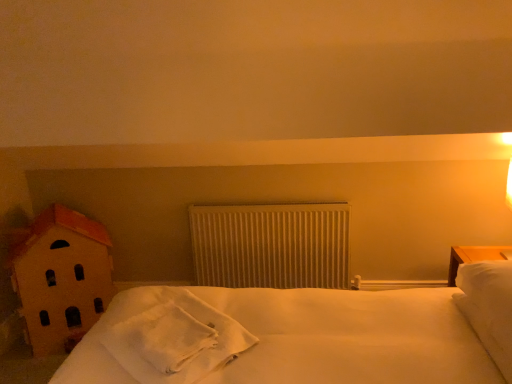
Question: Can you confirm if white soft pillow at right is shorter than white soft towel at center?

Choices:
 (A) yes
 (B) no

Answer: (B)

Question: Does white soft pillow at right appear on the left side of white soft towel at center?

Choices:
 (A) yes
 (B) no

Answer: (B)

Question: Is white soft pillow at right bigger than white soft towel at center?

Choices:
 (A) yes
 (B) no

Answer: (A)

Question: Is white soft pillow at right touching white soft towel at center?

Choices:
 (A) yes
 (B) no

Answer: (B)

Question: From the image's perspective, is white soft pillow at right on top of white soft towel at center?

Choices:
 (A) no
 (B) yes

Answer: (B)

Question: Can you confirm if white soft pillow at right is taller than white soft towel at center?

Choices:
 (A) no
 (B) yes

Answer: (B)

Question: Is white soft pillow at right inside white textured radiator at center?

Choices:
 (A) yes
 (B) no

Answer: (B)

Question: Is white textured radiator at center positioned with its back to white soft pillow at right?

Choices:
 (A) no
 (B) yes

Answer: (A)

Question: Is white textured radiator at center positioned before white soft pillow at right?

Choices:
 (A) no
 (B) yes

Answer: (A)

Question: Is white textured radiator at center completely or partially outside of white soft pillow at right?

Choices:
 (A) yes
 (B) no

Answer: (A)

Question: Is white textured radiator at center at the right side of white soft pillow at right?

Choices:
 (A) yes
 (B) no

Answer: (B)

Question: Is white textured radiator at center positioned far away from white soft pillow at right?

Choices:
 (A) no
 (B) yes

Answer: (B)

Question: Considering the relative sizes of white soft towel at center and wooden house at left in the image provided, is white soft towel at center thinner than wooden house at left?

Choices:
 (A) no
 (B) yes

Answer: (A)